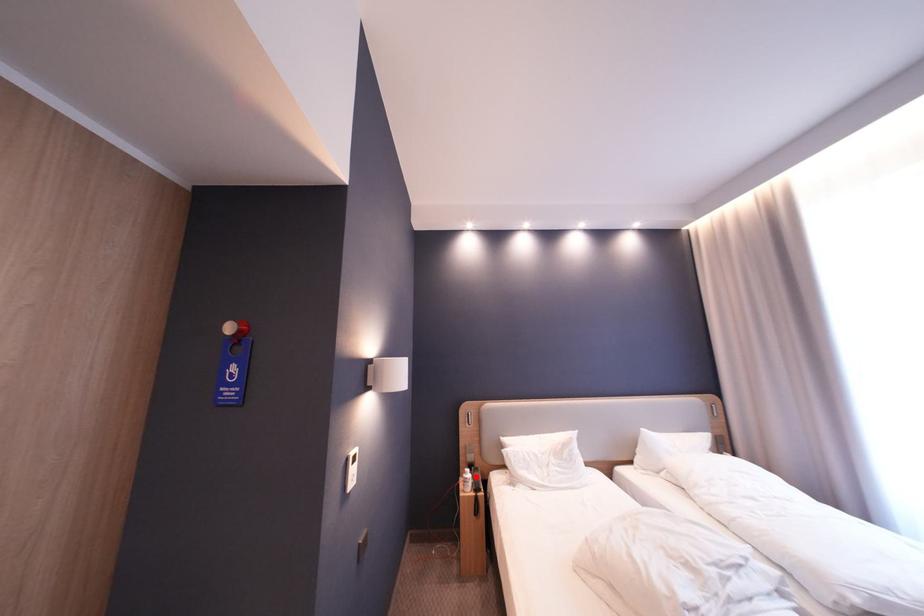
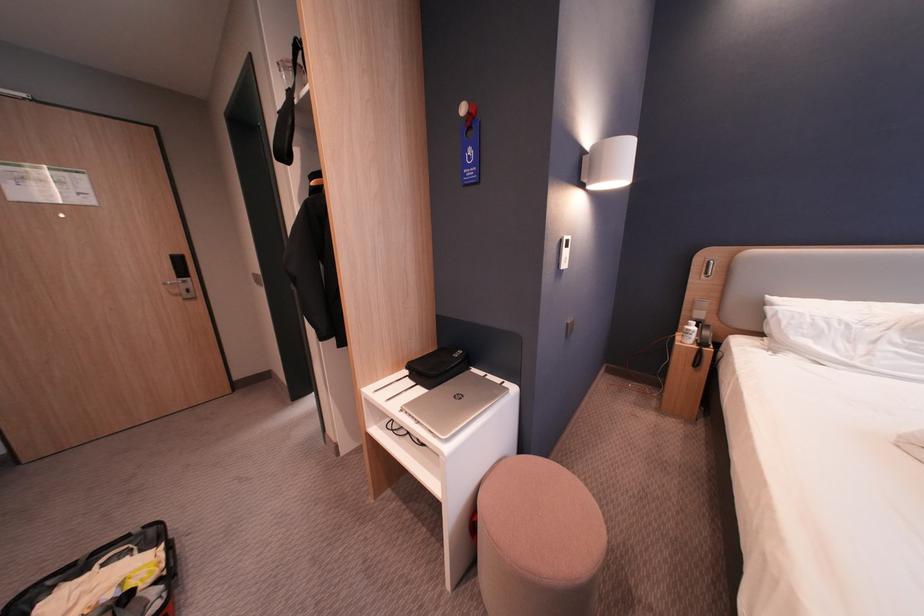
Question: A red point is marked in image1. In image2, is the corresponding 3D point closer to the camera or farther? Reply with the corresponding letter.

Choices:
 (A) The corresponding 3D point is closer.
 (B) The corresponding 3D point is farther.

Answer: (A)